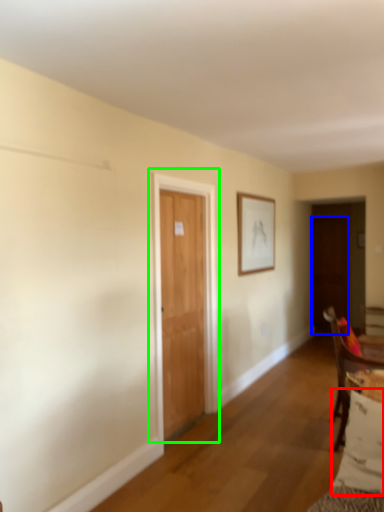
Question: Which object is positioned closest to pillow (highlighted by a red box)? Select from door (highlighted by a blue box) and door (highlighted by a green box).

Choices:
 (A) door
 (B) door

Answer: (B)